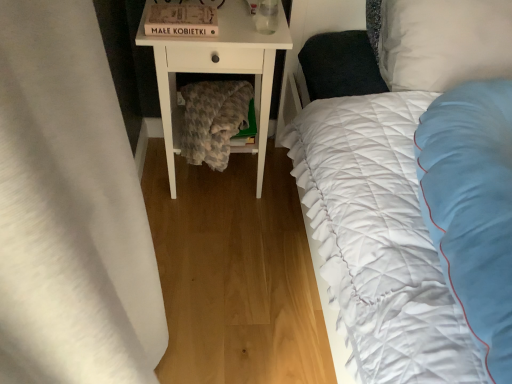
The image size is (512, 384). What do you see at coordinates (70, 209) in the screenshot?
I see `white fabric curtain at left` at bounding box center [70, 209].

Image resolution: width=512 pixels, height=384 pixels. Describe the element at coordinates (266, 16) in the screenshot. I see `clear glass at upper center` at that location.

Describe the element at coordinates (218, 71) in the screenshot. I see `white matte nightstand at center` at that location.

The image size is (512, 384). I want to click on white soft pillow at upper right, so [x=444, y=42].

What do you see at coordinates (213, 120) in the screenshot? I see `fuzzy gray blanket at lower center` at bounding box center [213, 120].

This screenshot has height=384, width=512. In order to click on white quilted bed at right in this screenshot , I will do `click(379, 238)`.

At what (x,y) coordinates should I click in order to perform the action: click on matte cardboard box at upper center. Please return your answer as a coordinate pair (x, y). The image size is (512, 384). Looking at the image, I should click on (181, 20).

Is white fabric curtain at left inside or outside of white matte nightstand at center?

The correct answer is: outside.

Is white fabric curtain at left turned away from white matte nightstand at center?

No, white fabric curtain at left is not facing the opposite direction of white matte nightstand at center.

Which is behind, white fabric curtain at left or white matte nightstand at center?

white matte nightstand at center.

I want to click on curtain below the white matte nightstand at center (from the image's perspective), so click(70, 209).

Is white fabric curtain at left located within fuzzy gray blanket at lower center?

No.

Is there a large distance between fuzzy gray blanket at lower center and white fabric curtain at left?

No.

From the picture: From the image's perspective, is fuzzy gray blanket at lower center located above white fabric curtain at left?

Yes.

How different are the orientations of fuzzy gray blanket at lower center and white fabric curtain at left in degrees?

90.4 degrees.

Is clear glass at upper center looking in the opposite direction of fuzzy gray blanket at lower center?

clear glass at upper center does not have its back to fuzzy gray blanket at lower center.

Find the location of `blanket below the clear glass at upper center (from a real-world perspective)`. blanket below the clear glass at upper center (from a real-world perspective) is located at coordinates (213, 120).

Is clear glass at upper center bigger than fuzzy gray blanket at lower center?

Actually, clear glass at upper center might be smaller than fuzzy gray blanket at lower center.

Is clear glass at upper center to the left or to the right of fuzzy gray blanket at lower center in the image?

clear glass at upper center is positioned on fuzzy gray blanket at lower center's right side.

Are white matte nightstand at center and white fabric curtain at left making contact?

No.

Can you confirm if white matte nightstand at center is taller than white fabric curtain at left?

No, white matte nightstand at center is not taller than white fabric curtain at left.

Looking at this image, is white matte nightstand at center oriented away from white fabric curtain at left?

No, white matte nightstand at center is not facing away from white fabric curtain at left.

From the image's perspective, is white soft pillow at upper right under clear glass at upper center?

Yes.

Considering the sizes of objects white soft pillow at upper right and clear glass at upper center in the image provided, who is shorter, white soft pillow at upper right or clear glass at upper center?

With less height is clear glass at upper center.

Is white soft pillow at upper right turned away from clear glass at upper center?

No, white soft pillow at upper right's orientation is not away from clear glass at upper center.

What's the angular difference between clear glass at upper center and matte cardboard box at upper center's facing directions?

The angular difference between clear glass at upper center and matte cardboard box at upper center is 1.7 degrees.

Looking at this image, which object is wider, clear glass at upper center or matte cardboard box at upper center?

With larger width is matte cardboard box at upper center.

From a real-world perspective, who is located higher, clear glass at upper center or matte cardboard box at upper center?

From a 3D spatial view, clear glass at upper center is above.

From the image's perspective, does clear glass at upper center appear lower than matte cardboard box at upper center?

No, from the image's perspective, clear glass at upper center is not beneath matte cardboard box at upper center.

Is matte cardboard box at upper center facing towards clear glass at upper center?

No, matte cardboard box at upper center is not facing towards clear glass at upper center.

How different are the orientations of matte cardboard box at upper center and clear glass at upper center in degrees?

matte cardboard box at upper center and clear glass at upper center are facing 1.7 degrees away from each other.

Does matte cardboard box at upper center lie behind clear glass at upper center?

Yes, matte cardboard box at upper center is behind clear glass at upper center.

Which point is more forward, (209, 32) or (260, 17)?

The point (209, 32) is closer.

This screenshot has height=384, width=512. Identify the location of curtain in front of the white matte nightstand at center. (70, 209).

Locate an element on the screen. This screenshot has height=384, width=512. blanket below the white fabric curtain at left (from a real-world perspective) is located at coordinates [x=213, y=120].

When comparing their distances from white fabric curtain at left, does white quilted bed at right or matte cardboard box at upper center seem closer?

white quilted bed at right is closer to white fabric curtain at left.

Looking at the image, which one is located closer to fuzzy gray blanket at lower center, white quilted bed at right or white soft pillow at upper right?

Among the two, white quilted bed at right is located nearer to fuzzy gray blanket at lower center.

Which object lies further to the anchor point fuzzy gray blanket at lower center, clear glass at upper center or white soft pillow at upper right?

The object further to fuzzy gray blanket at lower center is white soft pillow at upper right.

Looking at the image, which one is located closer to white quilted bed at right, white soft pillow at upper right or clear glass at upper center?

white soft pillow at upper right is positioned closer to the anchor white quilted bed at right.

When comparing their distances from white matte nightstand at center, does matte cardboard box at upper center or white soft pillow at upper right seem closer?

Among the two, matte cardboard box at upper center is located nearer to white matte nightstand at center.

Which object lies nearer to the anchor point white fabric curtain at left, matte cardboard box at upper center or white quilted bed at right?

white quilted bed at right is positioned closer to the anchor white fabric curtain at left.

Looking at the image, which one is located closer to fuzzy gray blanket at lower center, white matte nightstand at center or white soft pillow at upper right?

white matte nightstand at center is closer to fuzzy gray blanket at lower center.

When comparing their distances from white quilted bed at right, does matte cardboard box at upper center or fuzzy gray blanket at lower center seem closer?

fuzzy gray blanket at lower center is positioned closer to the anchor white quilted bed at right.

Image resolution: width=512 pixels, height=384 pixels. What are the coordinates of `cardboard box between white fabric curtain at left and white matte nightstand at center from front to back` in the screenshot? It's located at (181, 20).

The height and width of the screenshot is (384, 512). I want to click on nightstand positioned between white quilted bed at right and fuzzy gray blanket at lower center from near to far, so click(x=218, y=71).

What are the coordinates of `bed between white fabric curtain at left and matte cardboard box at upper center along the z-axis` in the screenshot? It's located at (379, 238).

Find the location of a particular element. The height and width of the screenshot is (384, 512). nightstand located between matte cardboard box at upper center and clear glass at upper center in the left-right direction is located at coordinates (218, 71).